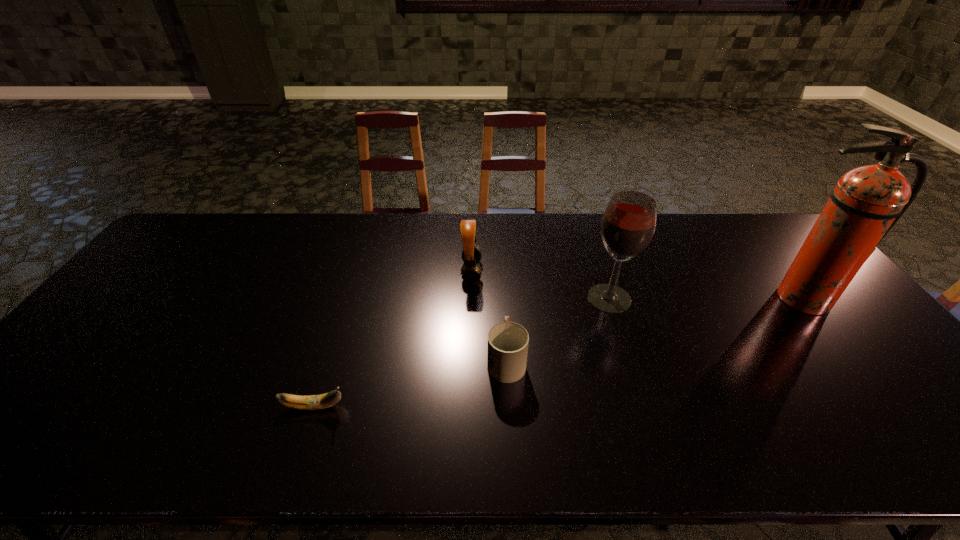
Where is `vacant area situated at the nozzle of the tallest object`? vacant area situated at the nozzle of the tallest object is located at coordinates (826, 329).

What are the coordinates of `vacant area situated 0.270m on the back of the second tallest object` in the screenshot? It's located at (588, 232).

Find the location of `vacant space situated on the ear cups of the headset`. vacant space situated on the ear cups of the headset is located at coordinates (504, 271).

At what (x,y) coordinates should I click in order to perform the action: click on vacant point located on the side of the second shortest object where the handle is located. Please return your answer as a coordinate pair (x, y). The width and height of the screenshot is (960, 540). Looking at the image, I should click on (502, 280).

You are a GUI agent. You are given a task and a screenshot of the screen. Output one action in this format:
    pyautogui.click(x=<x>, y=<y>)
    Task: Click on the vacant space located on the side of the second shortest object where the handle is located
    
    Given the screenshot: What is the action you would take?
    pyautogui.click(x=501, y=269)

I want to click on free location located on the side of the second shortest object where the handle is located, so click(x=503, y=310).

The height and width of the screenshot is (540, 960). I want to click on vacant space located at the stem of the nearest object, so (x=403, y=407).

Find the location of `object that is at the right edge`. object that is at the right edge is located at coordinates (867, 202).

Find the location of a particular element. This screenshot has height=540, width=960. vacant space at the far edge is located at coordinates (739, 241).

Image resolution: width=960 pixels, height=540 pixels. In the image, there is a desktop. Identify the location of vacant space at the near edge. (x=481, y=444).